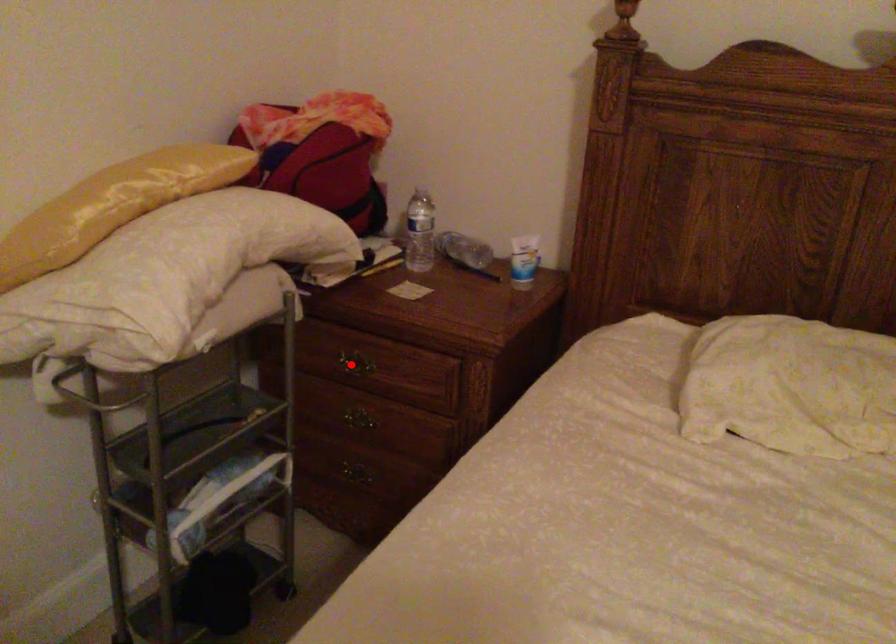
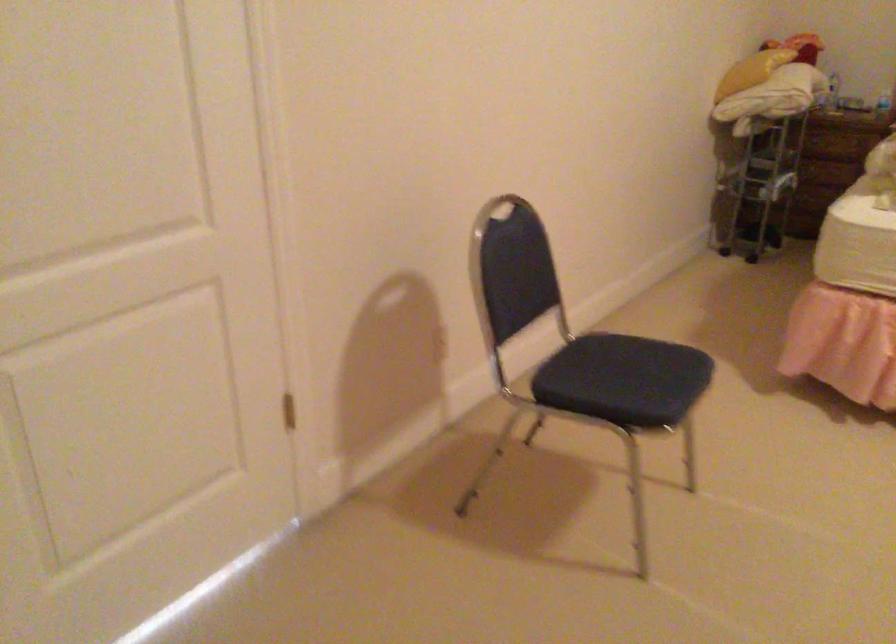
Question: I am providing you with two images of the same scene from different viewpoints. A red point is marked on the first image. Can you still see the location of the red point in image 2?

Choices:
 (A) Yes
 (B) No

Answer: (B)